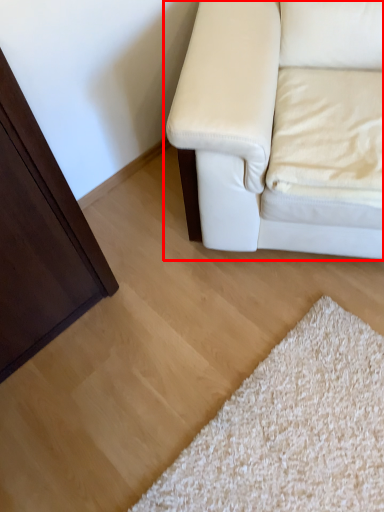
Question: Where is studio couch (annotated by the red box) located in relation to pillow in the image?

Choices:
 (A) left
 (B) right

Answer: (A)